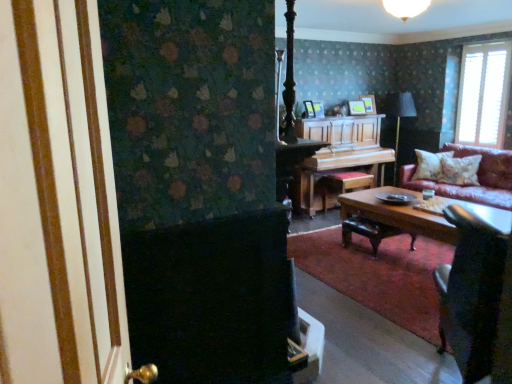
This screenshot has height=384, width=512. What do you see at coordinates (398, 214) in the screenshot?
I see `wooden polished coffee table at center` at bounding box center [398, 214].

This screenshot has height=384, width=512. Describe the element at coordinates (460, 170) in the screenshot. I see `fluffy white pillow at right, the 1th pillow positioned from the front` at that location.

Locate an element on the screen. The image size is (512, 384). wooden piano at center is located at coordinates (339, 152).

Looking at this image, could you tell me if wooden polished coffee table at center is turned towards wooden stool at center?

No, wooden polished coffee table at center is not facing towards wooden stool at center.

From the image's perspective, who appears lower, wooden polished coffee table at center or wooden stool at center?

From the image's view, wooden polished coffee table at center is below.

Which is closer, (438, 239) or (335, 188)?

The point (438, 239) is closer.

The width and height of the screenshot is (512, 384). What are the coordinates of `coffee table in front of the wooden stool at center` in the screenshot? It's located at (398, 214).

Does point (450, 229) come in front of point (456, 164)?

That is True.

Identify the location of coffee table below the fluffy white pillow at right, the 1th pillow positioned from the front (from the image's perspective). The height and width of the screenshot is (384, 512). (398, 214).

From the image's perspective, between wooden polished coffee table at center and fluffy white pillow at right, which appears as the 2th pillow when viewed from the back, which one is located above?

fluffy white pillow at right, which appears as the 2th pillow when viewed from the back.

What's the angular difference between wooden polished coffee table at center and fluffy white pillow at right, the 1th pillow positioned from the front,'s facing directions?

The facing directions of wooden polished coffee table at center and fluffy white pillow at right, the 1th pillow positioned from the front, are 22.3 degrees apart.

Based on the photo, is white glass lampshade at upper center at the left side of metallic gold table lamp at upper center?

Indeed, white glass lampshade at upper center is positioned on the left side of metallic gold table lamp at upper center.

Is white glass lampshade at upper center facing towards metallic gold table lamp at upper center?

No, white glass lampshade at upper center is not aimed at metallic gold table lamp at upper center.

Can you tell me how much white glass lampshade at upper center and metallic gold table lamp at upper center differ in facing direction?

There is a 89.1-degree angle between the facing directions of white glass lampshade at upper center and metallic gold table lamp at upper center.

From a real-world perspective, which is physically below, white glass lampshade at upper center or metallic gold table lamp at upper center?

metallic gold table lamp at upper center, from a real-world perspective.

At what (x,y) coordinates should I click in order to perform the action: click on table lamp that appears above the leather couch at right (from a real-world perspective). Please return your answer as a coordinate pair (x, y). The image size is (512, 384). Looking at the image, I should click on (398, 116).

Is metallic gold table lamp at upper center in front of or behind leather couch at right in the image?

Visually, metallic gold table lamp at upper center is located behind leather couch at right.

Is point (406, 108) closer or farther from the camera than point (504, 179)?

Clearly, point (406, 108) is more distant from the camera than point (504, 179).

Who is taller, wooden piano at center or metallic gold table lamp at upper center?

metallic gold table lamp at upper center is taller.

Which point is more forward, (329, 170) or (395, 103)?

The point (329, 170) is closer.

Can you tell me how much wooden piano at center and metallic gold table lamp at upper center differ in facing direction?

There is a 0.00067-degree angle between the facing directions of wooden piano at center and metallic gold table lamp at upper center.

This screenshot has width=512, height=384. What are the coordinates of `table lamp that appears on the right of wooden piano at center` in the screenshot? It's located at (398, 116).

From the image's perspective, is black matte screen door at left over velvet dark brown armchair at lower right?

Yes, from the image's perspective, black matte screen door at left is over velvet dark brown armchair at lower right.

From a real-world perspective, who is located lower, black matte screen door at left or velvet dark brown armchair at lower right?

velvet dark brown armchair at lower right.

Is point (59, 92) closer to viewer compared to point (479, 290)?

Yes, point (59, 92) is in front of point (479, 290).

Looking at this image, looking at their sizes, would you say black matte screen door at left is wider or thinner than velvet dark brown armchair at lower right?

In the image, black matte screen door at left appears to be more narrow than velvet dark brown armchair at lower right.

Is velvet dark brown armchair at lower right wider than leather couch at right?

In fact, velvet dark brown armchair at lower right might be narrower than leather couch at right.

What's the angular difference between velvet dark brown armchair at lower right and leather couch at right's facing directions?

velvet dark brown armchair at lower right and leather couch at right are facing 132 degrees away from each other.

Is velvet dark brown armchair at lower right not close to leather couch at right?

Absolutely, velvet dark brown armchair at lower right is distant from leather couch at right.

Looking at this image, how much distance is there between velvet dark brown armchair at lower right and leather couch at right?

velvet dark brown armchair at lower right and leather couch at right are 7.10 feet apart from each other.

At what (x,y) coordinates should I click in order to perform the action: click on stool behind the wooden polished coffee table at center. Please return your answer as a coordinate pair (x, y). Looking at the image, I should click on (344, 183).

You are a GUI agent. You are given a task and a screenshot of the screen. Output one action in this format:
    pyautogui.click(x=<x>, y=<y>)
    Task: Click on the 2nd pillow directly above the wooden polished coffee table at center (from a real-world perspective)
    
    Given the screenshot: What is the action you would take?
    pyautogui.click(x=460, y=170)

When comparing their distances from black matte screen door at left, does leather couch at right or fluffy white pillow at right, the 1th pillow positioned from the front, seem further?

Among the two, fluffy white pillow at right, the 1th pillow positioned from the front, is located further to black matte screen door at left.

Considering their positions, is white textured pillow at right, marked as the second pillow in a front-to-back arrangement, positioned further to white textured blinds at upper right than fluffy white pillow at right, which appears as the 2th pillow when viewed from the back?

Among the two, fluffy white pillow at right, which appears as the 2th pillow when viewed from the back, is located further to white textured blinds at upper right.

Which object lies further to the anchor point velvet dark brown armchair at lower right, white textured pillow at right, marked as the second pillow in a front-to-back arrangement, or metallic gold table lamp at upper center?

Among the two, metallic gold table lamp at upper center is located further to velvet dark brown armchair at lower right.

When comparing their distances from fluffy white pillow at right, which appears as the 2th pillow when viewed from the back, does black matte screen door at left or wooden piano at center seem further?

black matte screen door at left lies further to fluffy white pillow at right, which appears as the 2th pillow when viewed from the back, than the other object.

Estimate the real-world distances between objects in this image. Which object is further from white textured blinds at upper right, velvet dark brown armchair at lower right or wooden piano at center?

velvet dark brown armchair at lower right is further to white textured blinds at upper right.

Based on their spatial positions, is velvet dark brown armchair at lower right or wooden polished coffee table at center closer to wooden piano at center?

wooden polished coffee table at center is closer to wooden piano at center.

Estimate the real-world distances between objects in this image. Which object is further from black matte screen door at left, white glass lampshade at upper center or wooden polished coffee table at center?

white glass lampshade at upper center is further to black matte screen door at left.

Based on their spatial positions, is white textured pillow at right, marked as the second pillow in a front-to-back arrangement, or black matte screen door at left closer to leather couch at right?

white textured pillow at right, marked as the second pillow in a front-to-back arrangement, is positioned closer to the anchor leather couch at right.

Locate an element on the screen. table between velvet dark brown armchair at lower right and white textured pillow at right, marked as the second pillow in a front-to-back arrangement, from front to back is located at coordinates (339, 152).

The height and width of the screenshot is (384, 512). In order to click on light fixture positioned between velvet dark brown armchair at lower right and fluffy white pillow at right, the 1th pillow positioned from the front, from near to far in this screenshot , I will do `click(405, 8)`.

In order to click on coffee table between velvet dark brown armchair at lower right and white textured blinds at upper right along the z-axis in this screenshot , I will do `click(398, 214)`.

The width and height of the screenshot is (512, 384). Identify the location of pillow between black matte screen door at left and white textured pillow at right, the first pillow in the back-to-front sequence, along the z-axis. (460, 170).